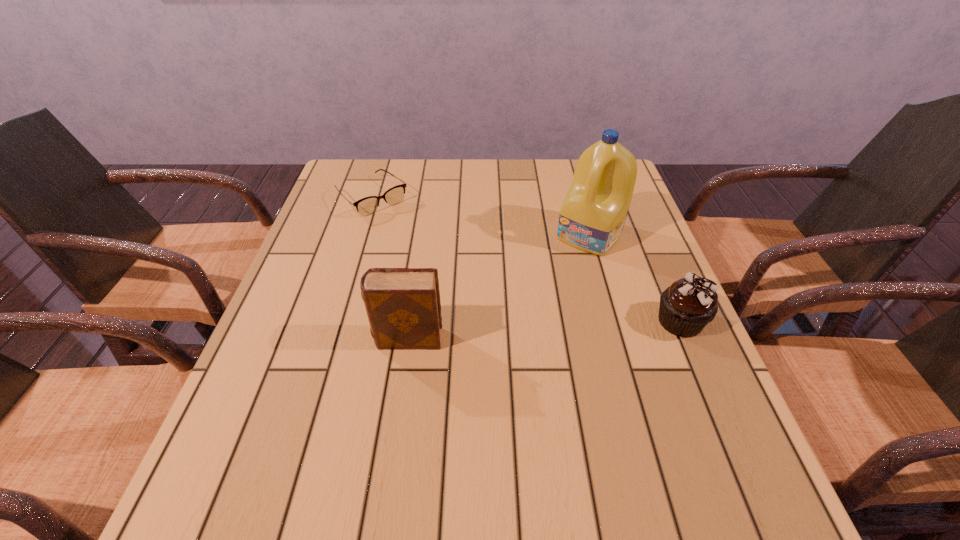
This screenshot has height=540, width=960. Identify the location of free spot on the desktop that is between the diary and the cupcake and is positioned on the face of the shortest object. (511, 332).

Where is `vacant spot on the desktop that is between the diary and the second shortest object and is positioned on the label of the tallest object`? vacant spot on the desktop that is between the diary and the second shortest object and is positioned on the label of the tallest object is located at coordinates (510, 332).